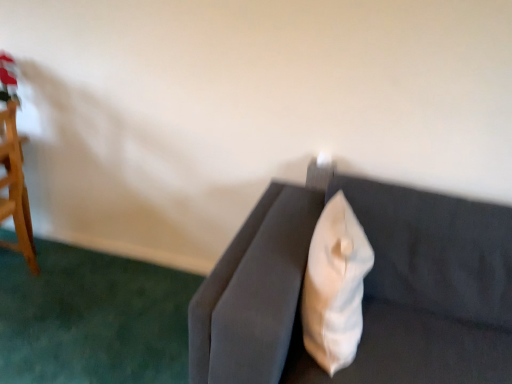
Question: Does white fabric pillow at upper right have a smaller size compared to velvet gray couch at center?

Choices:
 (A) yes
 (B) no

Answer: (A)

Question: Would you say white fabric pillow at upper right contains velvet gray couch at center?

Choices:
 (A) yes
 (B) no

Answer: (B)

Question: Is velvet gray couch at center at the back of white fabric pillow at upper right?

Choices:
 (A) yes
 (B) no

Answer: (A)

Question: Does white fabric pillow at upper right have a lesser width compared to velvet gray couch at center?

Choices:
 (A) yes
 (B) no

Answer: (A)

Question: From a real-world perspective, does white fabric pillow at upper right sit lower than velvet gray couch at center?

Choices:
 (A) no
 (B) yes

Answer: (A)

Question: Can you confirm if white fabric pillow at upper right is wider than velvet gray couch at center?

Choices:
 (A) no
 (B) yes

Answer: (A)

Question: Does velvet gray couch at center appear on the right side of white fabric pillow at upper right?

Choices:
 (A) no
 (B) yes

Answer: (B)

Question: Considering the relative sizes of velvet gray couch at center and white fabric pillow at upper right in the image provided, is velvet gray couch at center taller than white fabric pillow at upper right?

Choices:
 (A) no
 (B) yes

Answer: (B)

Question: Can white fabric pillow at upper right be found inside velvet gray couch at center?

Choices:
 (A) yes
 (B) no

Answer: (A)

Question: Can you confirm if velvet gray couch at center is shorter than white fabric pillow at upper right?

Choices:
 (A) no
 (B) yes

Answer: (A)

Question: Can you confirm if velvet gray couch at center is wider than white fabric pillow at upper right?

Choices:
 (A) yes
 (B) no

Answer: (A)

Question: Can we say velvet gray couch at center lies outside white fabric pillow at upper right?

Choices:
 (A) no
 (B) yes

Answer: (B)

Question: Based on their positions, is velvet gray couch at center located to the left or right of white fabric pillow at upper right?

Choices:
 (A) left
 (B) right

Answer: (B)